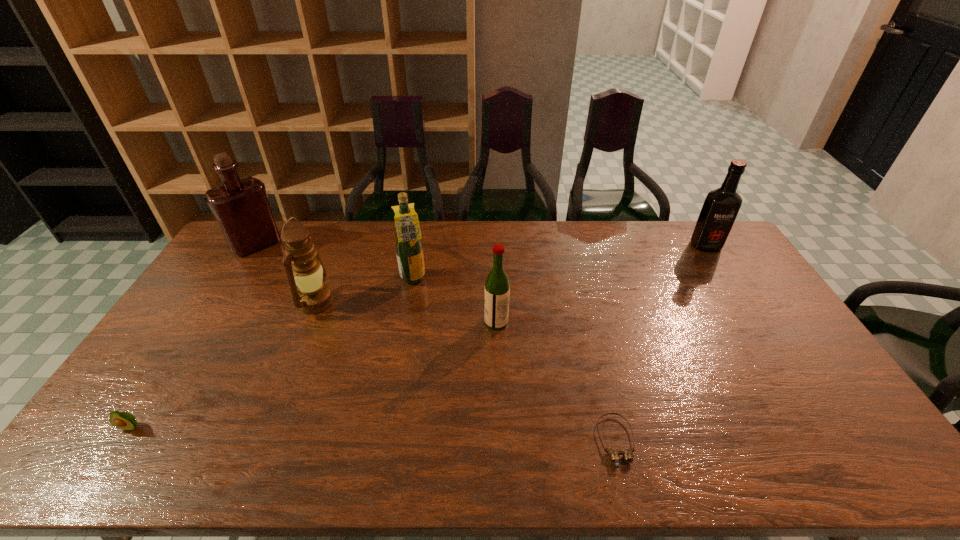
Identify the location of avocado that is at the left edge. This screenshot has height=540, width=960. (122, 420).

You are a GUI agent. You are given a task and a screenshot of the screen. Output one action in this format:
    pyautogui.click(x=<x>, y=<y>)
    Task: Click on the object present at the right edge
    This screenshot has width=960, height=540.
    Given the screenshot: What is the action you would take?
    pyautogui.click(x=721, y=206)

Identify the location of object present at the far left corner. The height and width of the screenshot is (540, 960). (241, 207).

The width and height of the screenshot is (960, 540). What are the coordinates of `object that is at the far right corner` in the screenshot? It's located at 721,206.

The height and width of the screenshot is (540, 960). What are the coordinates of `blank area at the far edge` in the screenshot? It's located at (426, 228).

In the image, there is a desktop. Identify the location of free space at the right edge. (734, 301).

You are a GUI agent. You are given a task and a screenshot of the screen. Output one action in this format:
    pyautogui.click(x=<x>, y=<y>)
    Task: Click on the empty space between the second liquor from right to left and the avocado
    The height and width of the screenshot is (540, 960).
    Given the screenshot: What is the action you would take?
    pyautogui.click(x=313, y=375)

Where is `free space between the nearest liquor and the goggles`? free space between the nearest liquor and the goggles is located at coordinates click(556, 382).

Find the location of a particular element. The width and height of the screenshot is (960, 540). empty space between the third object from right to left and the leftmost liquor is located at coordinates (376, 284).

This screenshot has width=960, height=540. I want to click on empty space that is in between the shortest object and the third object from right to left, so click(556, 382).